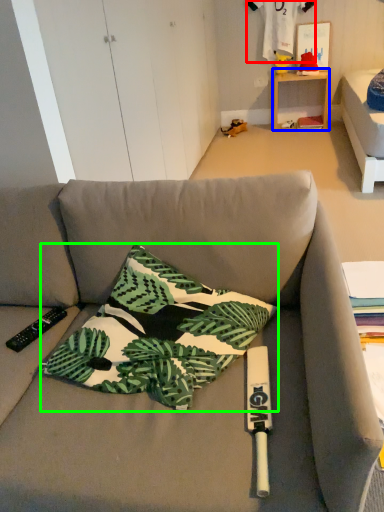
Question: Considering the real-world distances, which object is closest to fabric (highlighted by a red box)? table (highlighted by a blue box) or pillow (highlighted by a green box).

Choices:
 (A) table
 (B) pillow

Answer: (A)